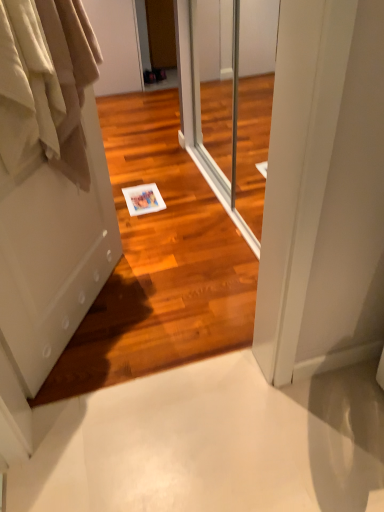
Where is `free spot to the right of white matte door at left`? This screenshot has height=512, width=384. free spot to the right of white matte door at left is located at coordinates (168, 302).